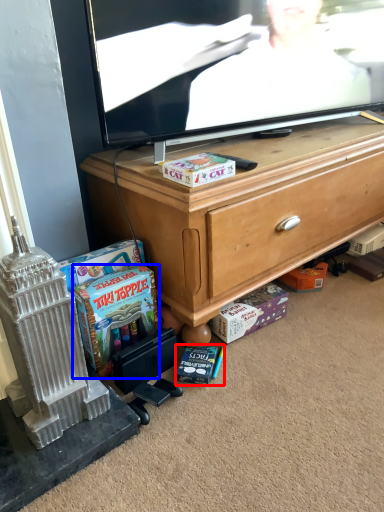
Question: Which object appears closest to the camera in this image, book (highlighted by a red box) or cash (highlighted by a blue box)?

Choices:
 (A) book
 (B) cash

Answer: (B)